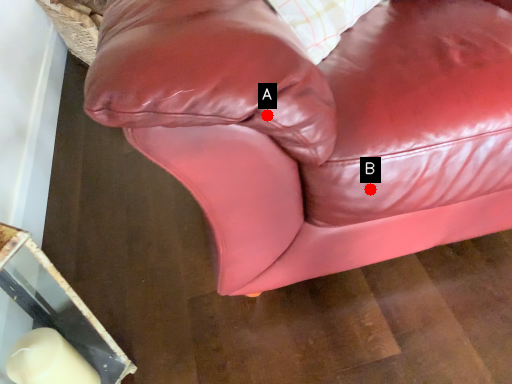
Question: Two points are circled on the image, labeled by A and B beside each circle. Which point appears closest to the camera in this image?

Choices:
 (A) A is closer
 (B) B is closer

Answer: (A)